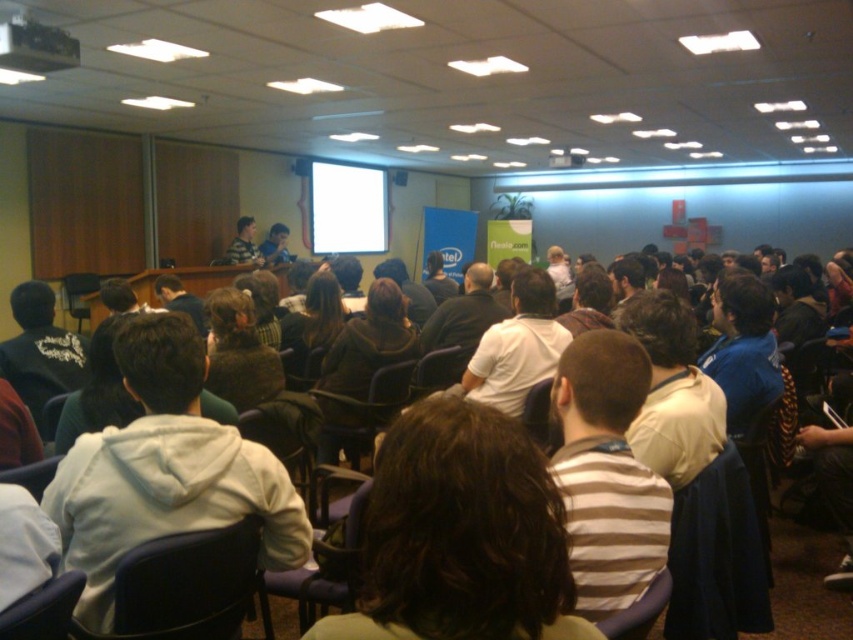
Is point (645, 458) positioned behind point (520, 349)?

No, it is not.

What do you see at coordinates (672, 392) in the screenshot?
I see `white shirt at center` at bounding box center [672, 392].

This screenshot has height=640, width=853. In order to click on white shirt at center in this screenshot , I will do `click(672, 392)`.

Does white fleece jacket at left have a larger size compared to matte black chair at lower center?

Yes.

Who is higher up, white fleece jacket at left or matte black chair at lower center?

white fleece jacket at left is higher up.

The height and width of the screenshot is (640, 853). What are the coordinates of `white fleece jacket at left` in the screenshot? It's located at (165, 468).

How distant is striped cotton shirt at center from matte plastic chair at center?

striped cotton shirt at center is 32.73 inches from matte plastic chair at center.

Image resolution: width=853 pixels, height=640 pixels. Describe the element at coordinates (607, 474) in the screenshot. I see `striped cotton shirt at center` at that location.

Find the location of `striped cotton shirt at center`. striped cotton shirt at center is located at coordinates (607, 474).